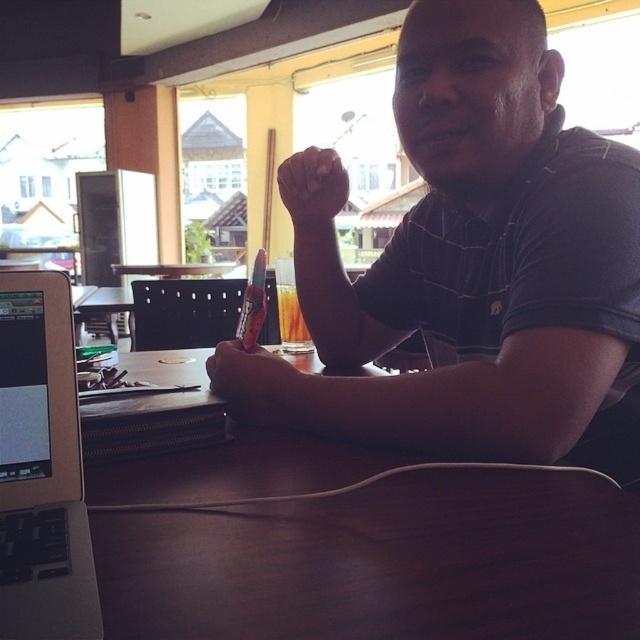
Does matte black shirt at center have a greater height compared to silver metallic laptop at left?

Indeed, matte black shirt at center has a greater height compared to silver metallic laptop at left.

Which is below, matte black shirt at center or silver metallic laptop at left?

Positioned lower is silver metallic laptop at left.

Between point (477, 419) and point (22, 314), which one is positioned in front?

Point (22, 314) is in front.

Find the location of a particular element. matte black shirt at center is located at coordinates (488, 262).

Is matte black shirt at center bigger than brown wood table at center?

Indeed, matte black shirt at center has a larger size compared to brown wood table at center.

Is matte black shirt at center taller than brown wood table at center?

Correct, matte black shirt at center is much taller as brown wood table at center.

Between point (451, 365) and point (308, 557), which one is positioned behind?

The point (451, 365) is behind.

Locate an element on the screen. The width and height of the screenshot is (640, 640). matte black shirt at center is located at coordinates (488, 262).

Does matte black shirt at center lie behind dark skin hand at center?

No, it is in front of dark skin hand at center.

Where is `matte black shirt at center`? The image size is (640, 640). matte black shirt at center is located at coordinates (488, 262).

Locate an element on the screen. The height and width of the screenshot is (640, 640). matte black shirt at center is located at coordinates (488, 262).